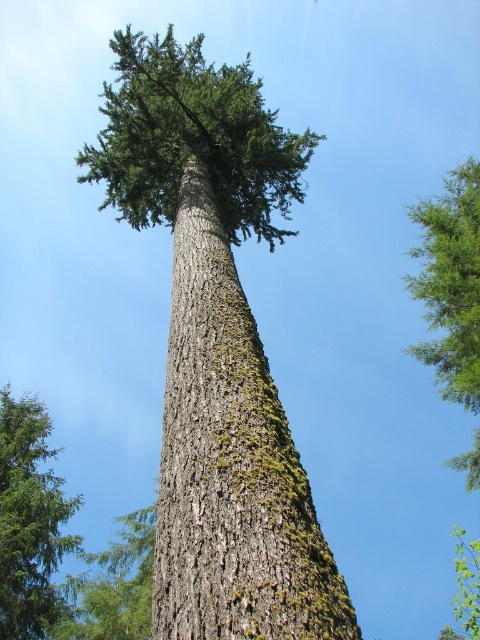
You are standing in a forest and see the green mossy bark at center and the green mossy tree at lower left. Which one is positioned to the right side?

The green mossy bark at center is positioned to the right of the green mossy tree at lower left.

You are a botanist studying the tree in the image. You need to locate the green mossy bark at center. Where exactly is it positioned on the tree?

The green mossy bark at center is located at point (x=230, y=464) on the tree.

You are a bird looking for a nesting spot. You need to choose between the green mossy tree at lower left and the green textured leaves at upper right. Which location is farther from the other object?

The green mossy tree at lower left and the green textured leaves at upper right are 10.32 meters apart, so both are equally distant from each other since the distance between them is fixed.